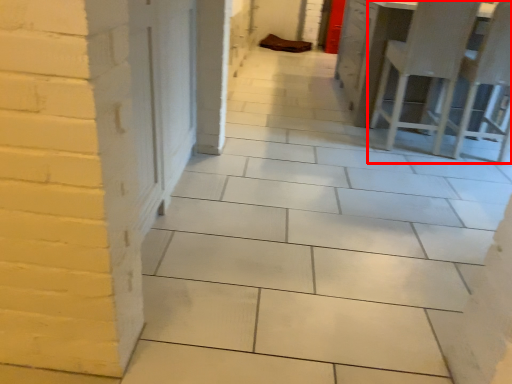
Question: Observing the image, what is the correct spatial positioning of furniture (annotated by the red box) in reference to chair?

Choices:
 (A) left
 (B) right

Answer: (A)